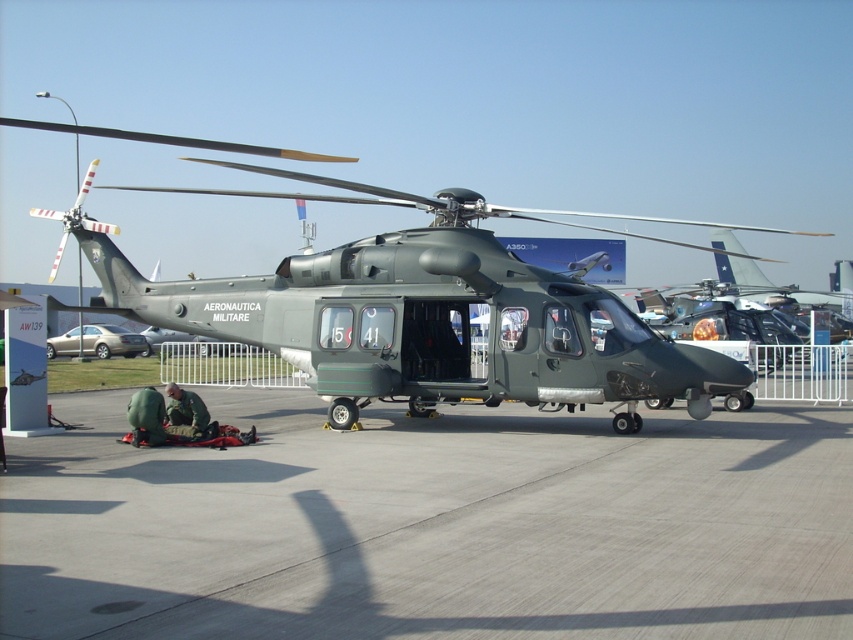
In the scene shown: You are a drone operator flying a drone that must stay above the gray concrete tarmac at center and the matte green helicopter at center. What object should the drone fly above to ensure it stays higher than both?

The drone should fly above the matte green helicopter at center because it has a greater height than the gray concrete tarmac at center.